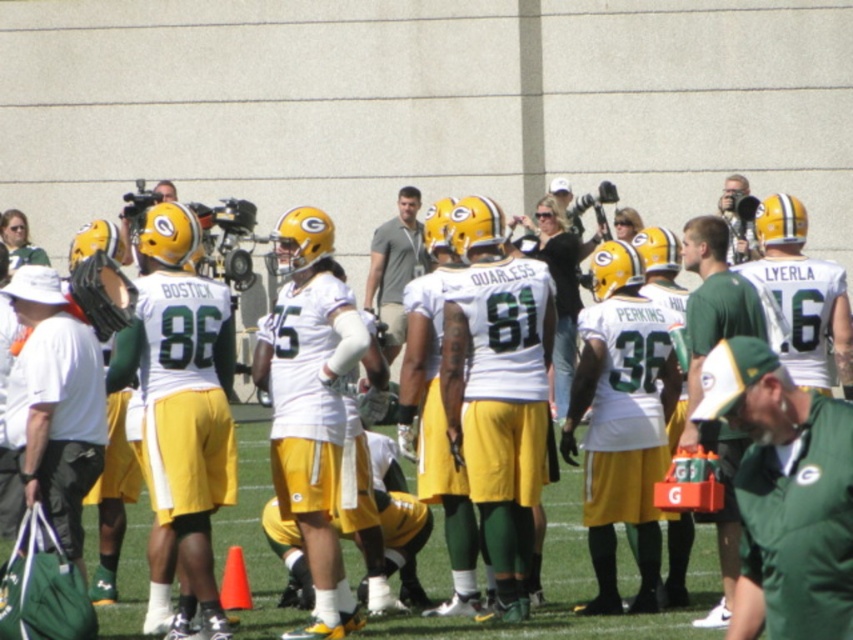
Question: Is white matte jersey at center above green matte helmet at center?

Choices:
 (A) yes
 (B) no

Answer: (B)

Question: Does green matte cap at center appear on the right side of metallic silver camera at upper right?

Choices:
 (A) yes
 (B) no

Answer: (B)

Question: Which point is farther to the camera?

Choices:
 (A) (692, 435)
 (B) (389, 346)
 (C) (569, 477)
 (D) (740, 246)

Answer: (B)

Question: Which of these objects is positioned farthest from the white matte hat at left?

Choices:
 (A) gray cotton shirt at center
 (B) green matte helmet at center

Answer: (A)

Question: Which of the following is the farthest from the observer?

Choices:
 (A) (49, 324)
 (B) (256, 628)

Answer: (B)

Question: Is white matte hat at left below green matte helmet at center?

Choices:
 (A) no
 (B) yes

Answer: (A)